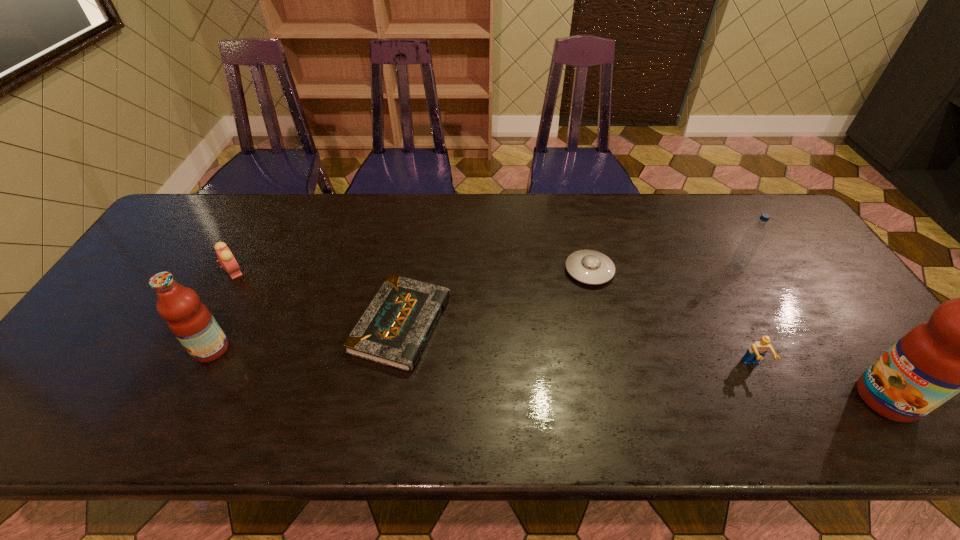
At what (x,y) coordinates should I click in order to perform the action: click on vacant point at the far left corner. Please return your answer as a coordinate pair (x, y). This screenshot has height=540, width=960. Looking at the image, I should click on (211, 228).

Locate an element on the screen. The image size is (960, 540). vacant space at the far right corner of the desktop is located at coordinates coord(748,207).

What are the coordinates of `unoccupied position between the water bottle and the nearer fruit juice` in the screenshot? It's located at (812, 332).

Image resolution: width=960 pixels, height=540 pixels. I want to click on free area in between the notebook and the tallest object, so click(x=644, y=361).

You are a GUI agent. You are given a task and a screenshot of the screen. Output one action in this format:
    pyautogui.click(x=<x>, y=<y>)
    Task: Click on the unoccupied area between the alarm clock and the fourth object from left to right
    
    Given the screenshot: What is the action you would take?
    pyautogui.click(x=412, y=271)

Where is `free point between the notebook and the fifth object from left to right`? The image size is (960, 540). free point between the notebook and the fifth object from left to right is located at coordinates (577, 345).

Where is `free space between the rightmost object and the alarm clock`? The image size is (960, 540). free space between the rightmost object and the alarm clock is located at coordinates (561, 335).

Locate an element on the screen. The height and width of the screenshot is (540, 960). unoccupied area between the nearer fruit juice and the second shortest object is located at coordinates (738, 334).

Where is `vacant area that lies between the notebook and the water bottle`? The width and height of the screenshot is (960, 540). vacant area that lies between the notebook and the water bottle is located at coordinates (569, 295).

I want to click on unoccupied position between the tallest object and the third object from right to left, so click(x=820, y=382).